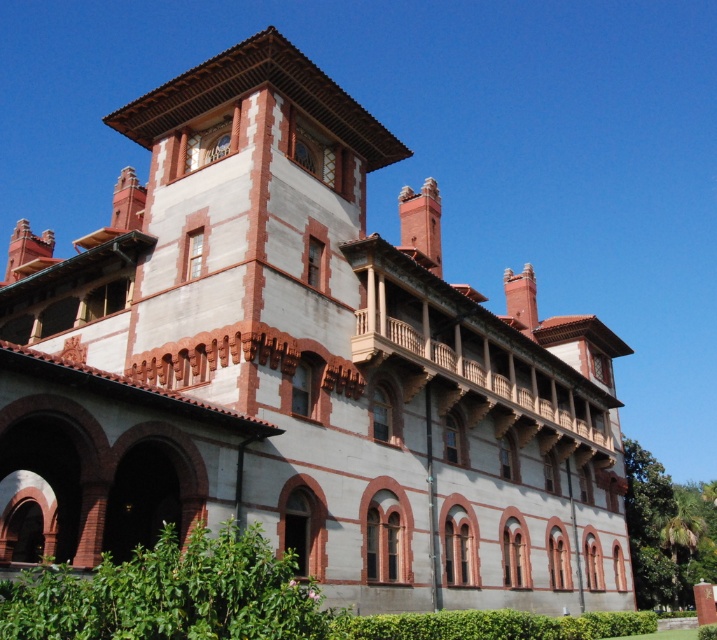
You are standing in front of the building and notice two green leafy hedges. One is labeled as the green leafy hedge at lower left and the other as the green leafy hedge at lower center. Which hedge is positioned more to the left side of the building?

The green leafy hedge at lower left is positioned more to the left side of the building compared to the green leafy hedge at lower center.